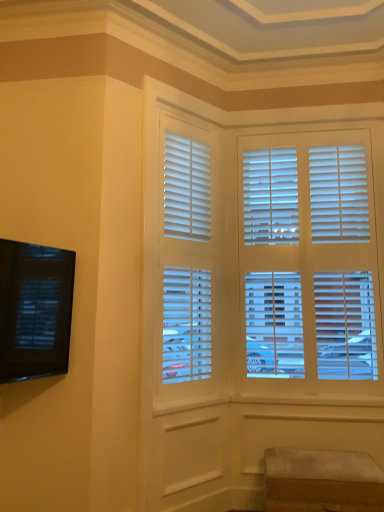
Consider the image. In order to face white matte blinds at center, should I rotate leftwards or rightwards?

You should rotate left by 0.933 degrees.

Find the location of a particular element. This screenshot has width=384, height=512. black glossy tv at left is located at coordinates (34, 310).

What is the approximate height of suede ottoman at lower right?

suede ottoman at lower right is 16.37 inches in height.

Identify the location of white matte blinds at center. The image size is (384, 512). (187, 269).

From a real-world perspective, is suede ottoman at lower right physically above white matte blinds at center?

Incorrect, from a real-world perspective, suede ottoman at lower right is lower than white matte blinds at center.

Does suede ottoman at lower right appear on the left side of white matte blinds at center?

No.

Relative to white matte blinds at center, is suede ottoman at lower right in front or behind?

suede ottoman at lower right is in front of white matte blinds at center.

Is suede ottoman at lower right placed right next to white matte blinds at center?

suede ottoman at lower right and white matte blinds at center are not in contact.

Would you say black glossy tv at left contains suede ottoman at lower right?

Actually, suede ottoman at lower right is outside black glossy tv at left.

In the scene shown: From the image's perspective, is black glossy tv at left positioned above or below suede ottoman at lower right?

black glossy tv at left is situated higher than suede ottoman at lower right in the image.

Consider the image. Is black glossy tv at left thinner than suede ottoman at lower right?

Correct, the width of black glossy tv at left is less than that of suede ottoman at lower right.

Which is behind, point (46, 270) or point (332, 493)?

Point (332, 493)

Which is in front, point (67, 329) or point (177, 409)?

The point (67, 329) is closer.

Does black glossy tv at left have a lesser width compared to white matte blinds at center?

Indeed, black glossy tv at left has a lesser width compared to white matte blinds at center.

Would you consider black glossy tv at left to be distant from white matte blinds at center?

No, there isn't a large distance between black glossy tv at left and white matte blinds at center.

Is white matte blinds at center positioned behind suede ottoman at lower right?

Yes, white matte blinds at center is further from the viewer.

In terms of size, does white matte blinds at center appear bigger or smaller than suede ottoman at lower right?

In the image, white matte blinds at center appears to be larger than suede ottoman at lower right.

Who is shorter, white matte blinds at center or suede ottoman at lower right?

With less height is suede ottoman at lower right.

Which object is wider, white matte blinds at center or suede ottoman at lower right?

Wider between the two is suede ottoman at lower right.

From the image's perspective, which is below, suede ottoman at lower right or black glossy tv at left?

suede ottoman at lower right.

Considering the sizes of objects suede ottoman at lower right and black glossy tv at left in the image provided, who is thinner, suede ottoman at lower right or black glossy tv at left?

black glossy tv at left is thinner.

Is suede ottoman at lower right looking in the opposite direction of black glossy tv at left?

suede ottoman at lower right is not turned away from black glossy tv at left.

From a real-world perspective, who is located higher, suede ottoman at lower right or black glossy tv at left?

black glossy tv at left, from a real-world perspective.

There is a black glossy tv at left. At what (x,y) coordinates should I click in order to perform the action: click on window above it (from a real-world perspective). Please return your answer as a coordinate pair (x, y). Image resolution: width=384 pixels, height=512 pixels. Looking at the image, I should click on (187, 269).

Looking at the image, does white matte blinds at center seem bigger or smaller compared to black glossy tv at left?

In the image, white matte blinds at center appears to be larger than black glossy tv at left.

From the image's perspective, is white matte blinds at center positioned above or below black glossy tv at left?

Clearly, from the image's perspective, white matte blinds at center is above black glossy tv at left.

In the image, there is a white matte blinds at center. At what (x,y) coordinates should I click in order to perform the action: click on furniture below it (from the image's perspective). Please return your answer as a coordinate pair (x, y). This screenshot has width=384, height=512. Looking at the image, I should click on (322, 481).

Locate an element on the screen. furniture located underneath the black glossy tv at left (from a real-world perspective) is located at coordinates (322, 481).

Based on their spatial positions, is black glossy tv at left or white matte blinds at center further from suede ottoman at lower right?

Based on the image, black glossy tv at left appears to be further to suede ottoman at lower right.

When comparing their distances from suede ottoman at lower right, does white matte blinds at center or black glossy tv at left seem further?

Based on the image, black glossy tv at left appears to be further to suede ottoman at lower right.

Estimate the real-world distances between objects in this image. Which object is closer to white matte blinds at center, suede ottoman at lower right or black glossy tv at left?

black glossy tv at left.

Estimate the real-world distances between objects in this image. Which object is closer to black glossy tv at left, suede ottoman at lower right or white matte blinds at center?

white matte blinds at center lies closer to black glossy tv at left than the other object.

Consider the image. When comparing their distances from white matte blinds at center, does black glossy tv at left or suede ottoman at lower right seem further?

suede ottoman at lower right lies further to white matte blinds at center than the other object.

Looking at the image, which one is located closer to black glossy tv at left, white matte blinds at center or suede ottoman at lower right?

white matte blinds at center is closer to black glossy tv at left.

Locate an element on the screen. window between black glossy tv at left and suede ottoman at lower right in the horizontal direction is located at coordinates (187, 269).